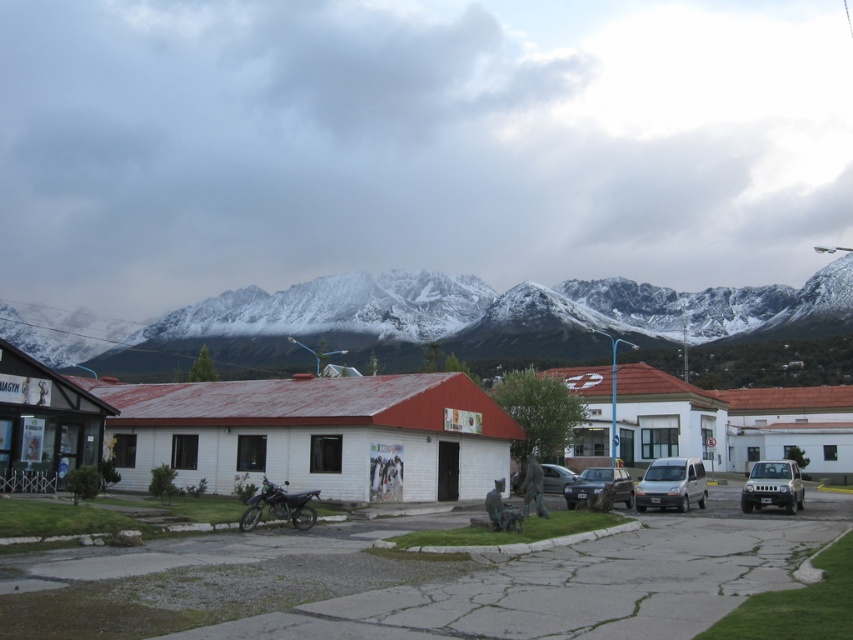
In the scene shown: You are a delivery person who needs to park your vehicle in the parking lot near the white building with a red roof. You have a silver metallic van at center and a black matte motorcycle at lower left. Which vehicle should you choose to park closer to the entrance of the building?

The black matte motorcycle at lower left should be chosen because it is positioned to the left of the silver metallic van at center, placing it closer to the entrance of the white building with a red roof.